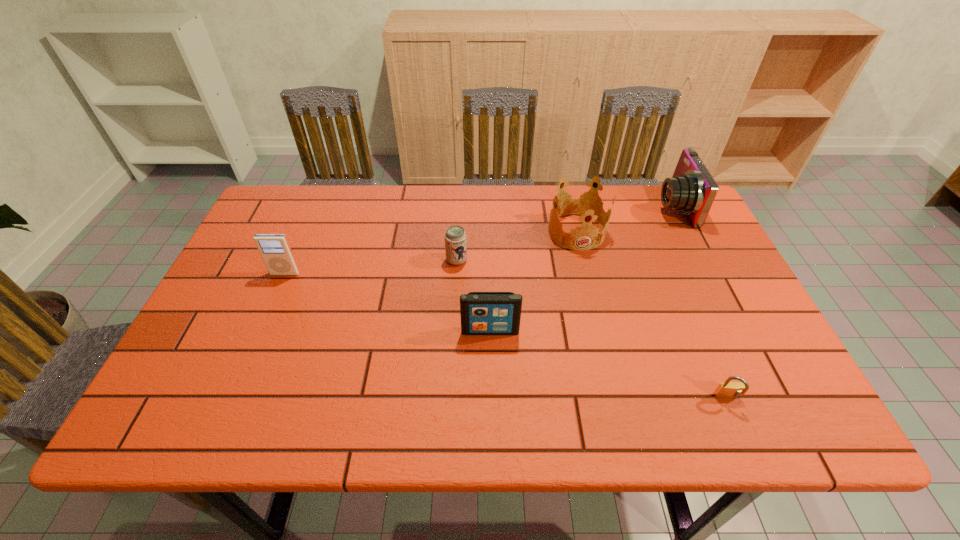
You are a GUI agent. You are given a task and a screenshot of the screen. Output one action in this format:
    pyautogui.click(x=<x>, y=<y>)
    Task: Click on the camera
    This screenshot has width=960, height=540.
    Given the screenshot: What is the action you would take?
    pyautogui.click(x=692, y=189)

You are a GUI agent. You are given a task and a screenshot of the screen. Output one action in this format:
    pyautogui.click(x=<x>, y=<y>)
    Task: Click on the third object from right to left
    The image size is (960, 540).
    Given the screenshot: What is the action you would take?
    pyautogui.click(x=582, y=204)

Image resolution: width=960 pixels, height=540 pixels. I want to click on the leftmost object, so click(x=274, y=249).

At what (x,y) coordinates should I click in order to perform the action: click on the farther iPod. Please return your answer as a coordinate pair (x, y). The height and width of the screenshot is (540, 960). Looking at the image, I should click on (274, 249).

Where is `the nearer iPod`? The height and width of the screenshot is (540, 960). the nearer iPod is located at coordinates (482, 313).

What are the coordinates of `the second nearest object` in the screenshot? It's located at [x=482, y=313].

Locate an element on the screen. the fifth tallest object is located at coordinates (455, 237).

Locate an element on the screen. The image size is (960, 540). beer can is located at coordinates (455, 237).

You are a GUI agent. You are given a task and a screenshot of the screen. Output one action in this format:
    pyautogui.click(x=<x>, y=<y>)
    Task: Click on the fifth object from left to right
    
    Given the screenshot: What is the action you would take?
    pyautogui.click(x=726, y=390)

Locate an element on the screen. the shortest object is located at coordinates (726, 390).